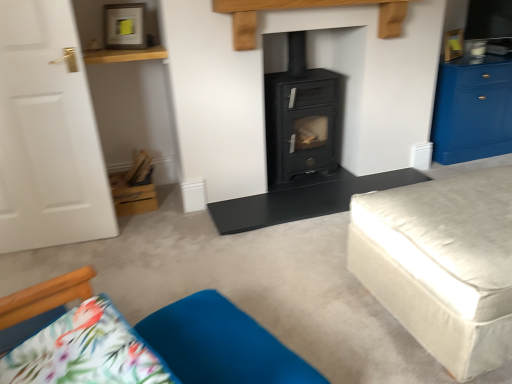
Find the location of a particular element. Image resolution: width=512 pixels, height=384 pixels. empty space that is ontop of velvety blue cushion at lower center (from a real-world perspective) is located at coordinates (220, 340).